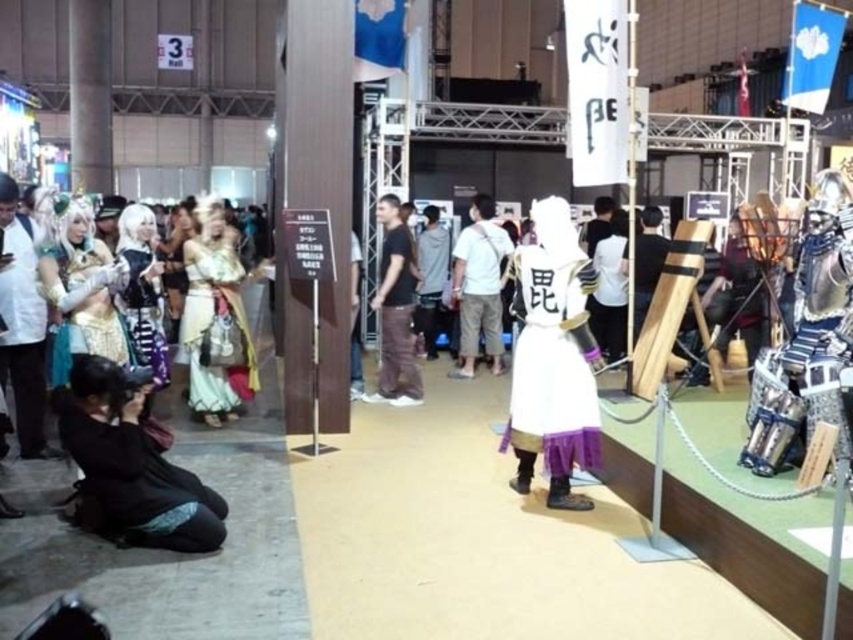
You are standing at the entrance of the convention hall and see the black fabric outfit at lower left represented by point (131, 467). Is the outfit closer to the entrance or further away from it?

The black fabric outfit at lower left represented by point (131, 467) is closer to the entrance since it is positioned at the lower part of the image, which typically corresponds to the foreground in such scenes.